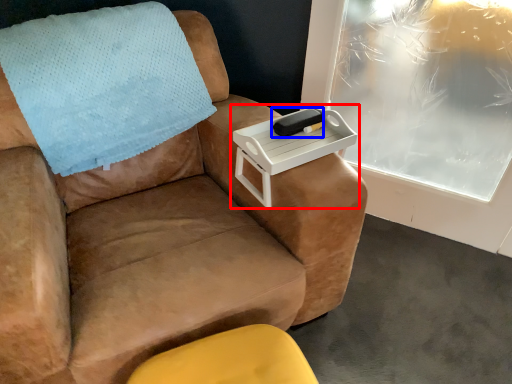
Question: Among these objects, which one is nearest to the camera, table (highlighted by a red box) or pad (highlighted by a blue box)?

Choices:
 (A) table
 (B) pad

Answer: (A)